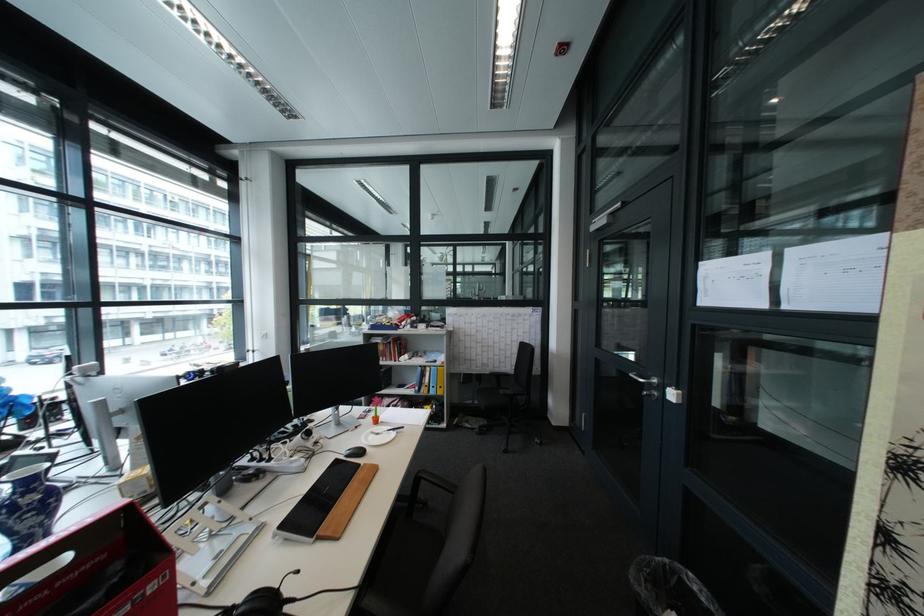
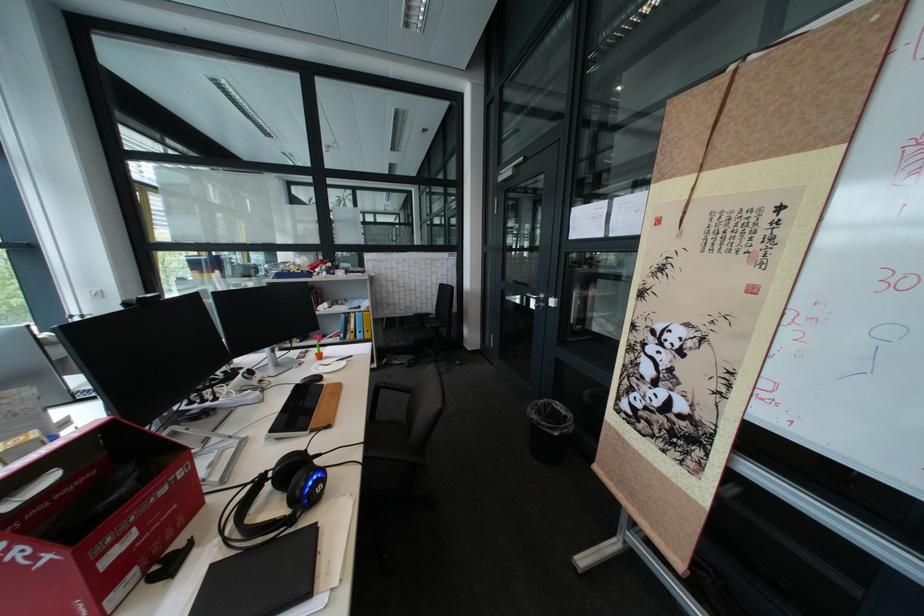
Locate, in the second image, the point that corresponds to point 673,560 in the first image.

(555, 400)